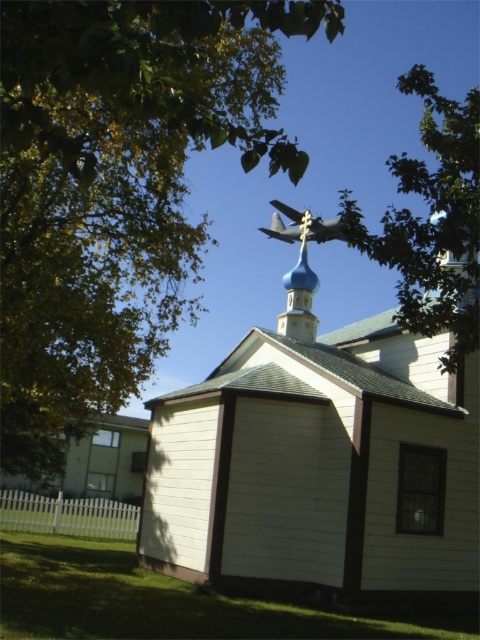
Question: Does white wood chapel at center come behind blue glossy dome at center?

Choices:
 (A) no
 (B) yes

Answer: (A)

Question: Is white wood chapel at center positioned at the back of blue glossy dome at center?

Choices:
 (A) no
 (B) yes

Answer: (A)

Question: Which object is the closest to the green leafy tree at upper left?

Choices:
 (A) blue glossy dome at center
 (B) white wood chapel at center
 (C) metallic gray airplane at upper center
 (D) green leafy tree at upper right

Answer: (B)

Question: Is white wood chapel at center above blue glossy dome at center?

Choices:
 (A) yes
 (B) no

Answer: (B)

Question: Which object appears closest to the camera in this image?

Choices:
 (A) white wood chapel at center
 (B) green leafy tree at upper right

Answer: (B)

Question: Which point is farther to the camera?

Choices:
 (A) green leafy tree at upper right
 (B) metallic gray airplane at upper center
 (C) blue glossy dome at center

Answer: (C)